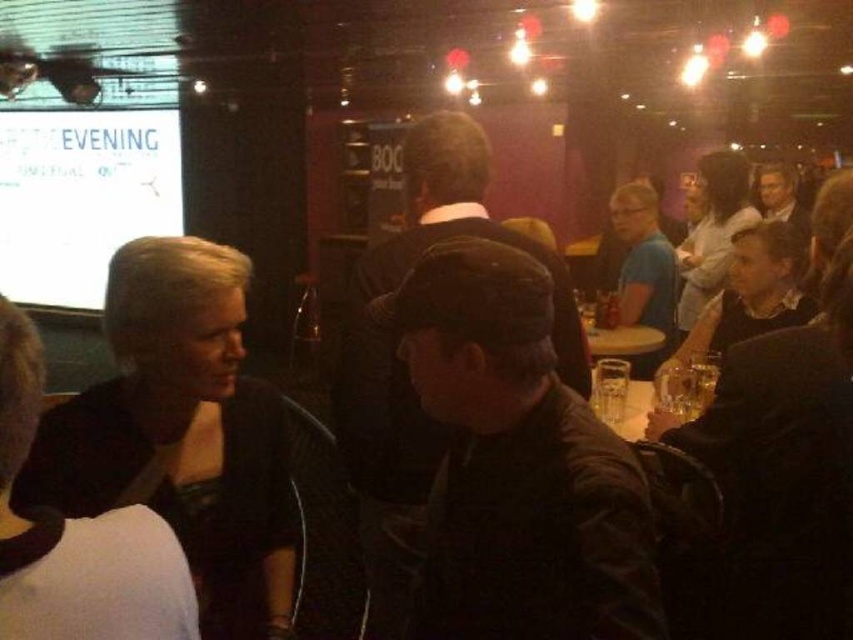
You are a bartender in the bar and need to place a 10 cm thick book on the nearest available surface. The dark brown leather jacket at lower left and the white glossy projection screen at upper left are in your line of sight. Which surface can accommodate the book?

The dark brown leather jacket at lower left is thinner than the white glossy projection screen at upper left, so the white glossy projection screen at upper left is thicker and can accommodate the 10 cm thick book.

You are a guest at this event and want to take a photo of the white glossy projection screen at upper left without including the dark brown leather jacket at lower left in the frame. Is it possible to do so by adjusting your camera angle?

The dark brown leather jacket at lower left is shorter than the white glossy projection screen at upper left. By angling the camera upwards to focus on the upper portion of the screen, you can exclude the jacket from the frame since it is shorter and positioned lower down.